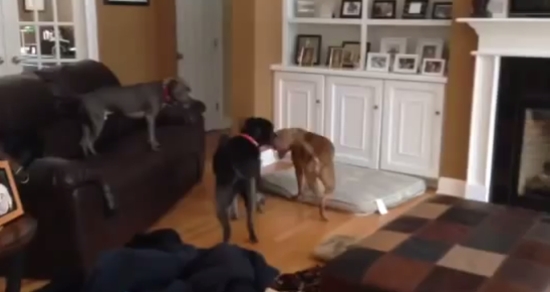
You are a GUI agent. You are given a task and a screenshot of the screen. Output one action in this format:
    pyautogui.click(x=<x>, y=<y>)
    Task: Click on the cabinets under the bookshelf
    Image resolution: width=550 pixels, height=292 pixels.
    Given the screenshot: What is the action you would take?
    pyautogui.click(x=302, y=110), pyautogui.click(x=353, y=121), pyautogui.click(x=403, y=116)